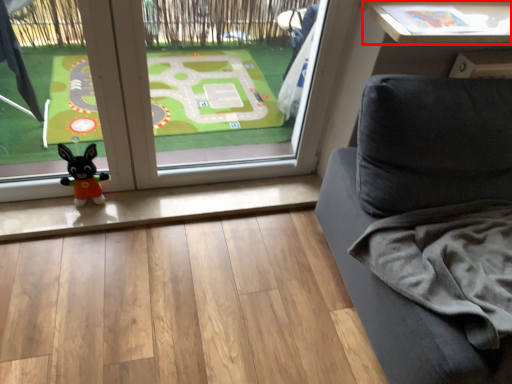
Question: From the image's perspective, where is table (annotated by the red box) located in relation to window in the image?

Choices:
 (A) below
 (B) above

Answer: (B)